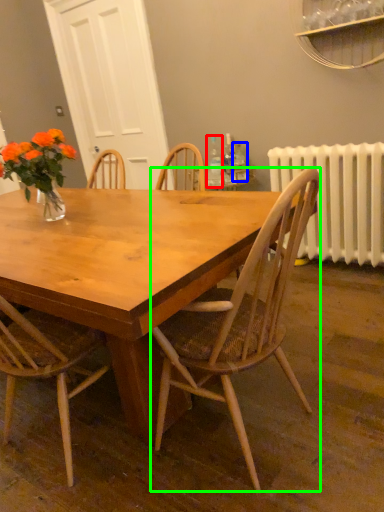
Question: Which object is the farthest from bottle (highlighted by a red box)? Choose among these: bottle (highlighted by a blue box) or chair (highlighted by a green box).

Choices:
 (A) bottle
 (B) chair

Answer: (B)